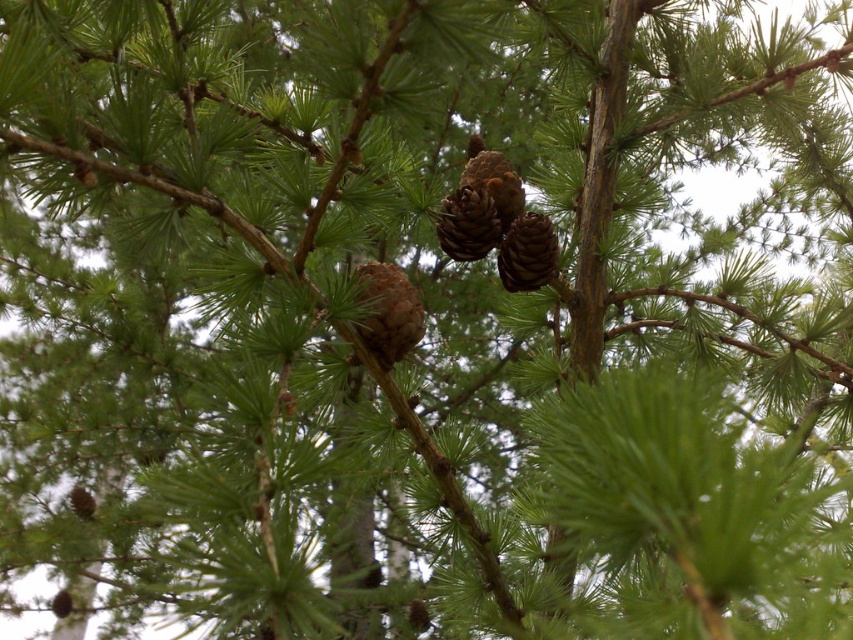
Is brown matte pine cone at center shorter than brown rough pine cone at center?

Yes, brown matte pine cone at center is shorter than brown rough pine cone at center.

In the scene shown: Between brown matte pine cone at center and brown rough pine cone at center, which one has more height?

Standing taller between the two is brown rough pine cone at center.

Where is `brown matte pine cone at center`? The image size is (853, 640). brown matte pine cone at center is located at coordinates (387, 312).

The height and width of the screenshot is (640, 853). What are the coordinates of `brown matte pine cone at center` in the screenshot? It's located at (387, 312).